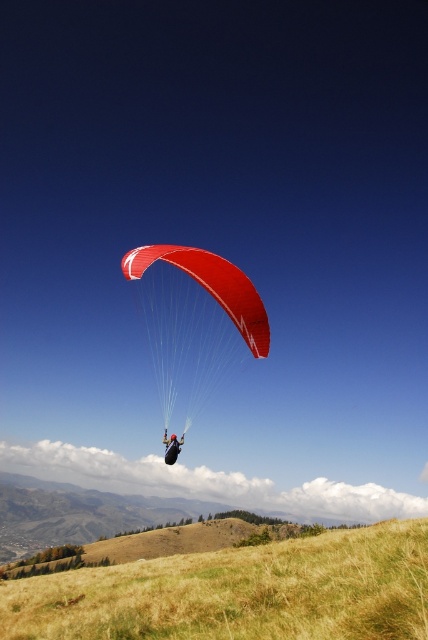
You are a pilot preparing for a tandem paraglide flight with a passenger. You have two parachutes available, the shiny red parachute at center and the black fabric parachute at center. Based on their sizes, which parachute should you choose to ensure enough space for both of you?

The shiny red parachute at center is bigger than the black fabric parachute at center, so you should choose the shiny red parachute at center to ensure enough space for both you and your passenger.

You are a paraglider pilot preparing to land. You notice the golden dry grass at lower center and the black fabric parachute at center. Which area should you aim for if you want to land in a wider space?

You should aim for the golden dry grass at lower center because it might be wider than the black fabric parachute at center.